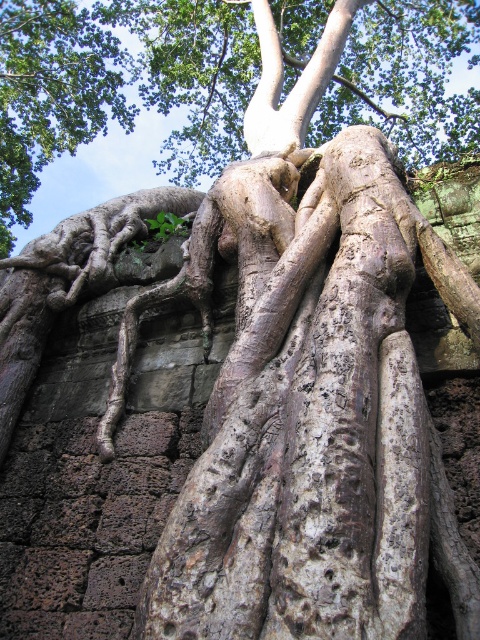
Can you confirm if rough bark roots at center is taller than green rough bark roots at upper left?

Incorrect, rough bark roots at center's height is not larger of green rough bark roots at upper left's.

Locate an element on the screen. rough bark roots at center is located at coordinates (120, 84).

Describe the element at coordinates (120, 84) in the screenshot. Image resolution: width=480 pixels, height=640 pixels. I see `rough bark roots at center` at that location.

Locate an element on the screen. rough bark roots at center is located at coordinates (120, 84).